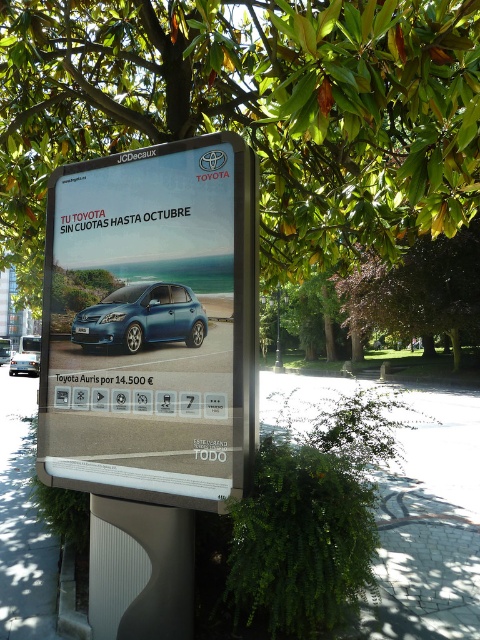
You are standing in front of the Toyota advertisement board in the park. You want to place a small flower pot on the paved stone at lower center. If your arms can reach up to 2 meters, can you place the flower pot without moving closer?

The paved stone at lower center is 3.18 meters away from the viewer. Since your arms can only reach up to 2 meters, you cannot place the flower pot without moving closer.

You are standing in front of the Toyota advertisement board. There are two points marked on the board at coordinates point [381,577] and point [108,307]. Which point is closer to you?

Point [108,307] is closer to you because it is less further away than point [381,577].